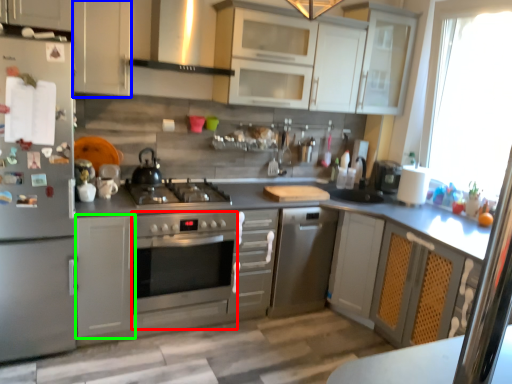
Question: Which object is positioned closest to oven (highlighted by a red box)? Select from cabinetry (highlighted by a blue box) and cabinetry (highlighted by a green box).

Choices:
 (A) cabinetry
 (B) cabinetry

Answer: (B)